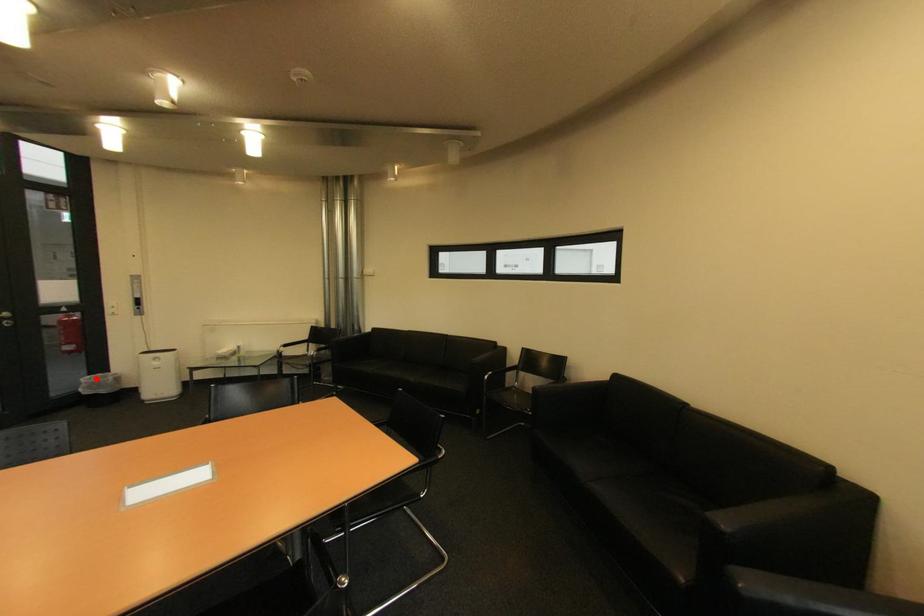
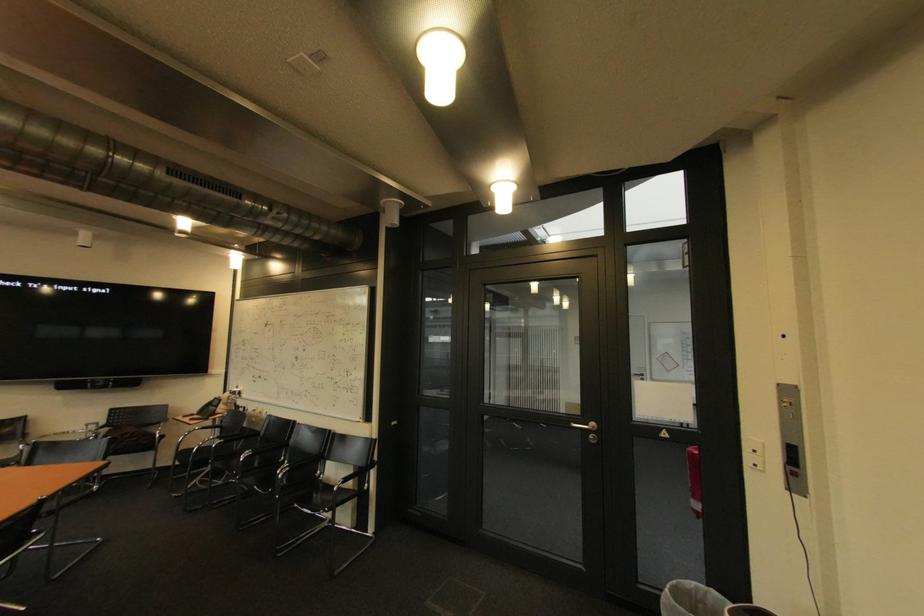
The point at the highlighted location is marked in the first image. Where is the corresponding point in the second image?

(701, 585)